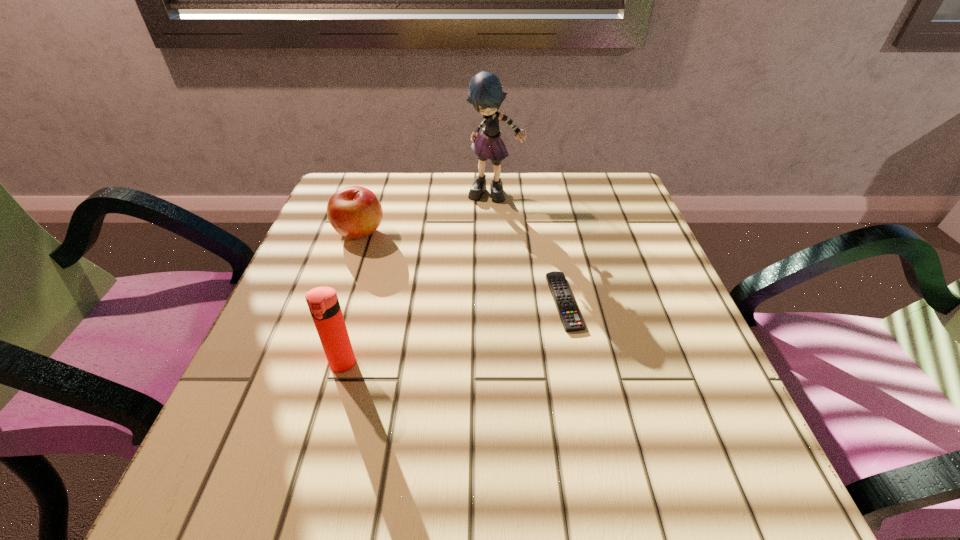
Locate an element on the screen. This screenshot has width=960, height=540. blank space located on the right of the second farthest object is located at coordinates (483, 232).

Image resolution: width=960 pixels, height=540 pixels. Find the location of `free region located 0.180m on the right of the second nearest object`. free region located 0.180m on the right of the second nearest object is located at coordinates (674, 301).

What are the coordinates of `rag doll that is at the far edge` in the screenshot? It's located at (486, 94).

Identify the location of apple that is at the far edge. The height and width of the screenshot is (540, 960). (355, 212).

Where is `thermos bottle located in the left edge section of the desktop`? Image resolution: width=960 pixels, height=540 pixels. thermos bottle located in the left edge section of the desktop is located at coordinates (323, 303).

Where is `apple located at the left edge`? This screenshot has width=960, height=540. apple located at the left edge is located at coordinates (355, 212).

The image size is (960, 540). Find the location of `object present at the far left corner`. object present at the far left corner is located at coordinates (355, 212).

Locate an element on the screen. vacant space at the far edge of the desktop is located at coordinates (539, 217).

Image resolution: width=960 pixels, height=540 pixels. In the image, there is a desktop. Find the location of `free region at the near edge`. free region at the near edge is located at coordinates (388, 459).

This screenshot has height=540, width=960. Find the location of `free region at the left edge of the desktop`. free region at the left edge of the desktop is located at coordinates (295, 406).